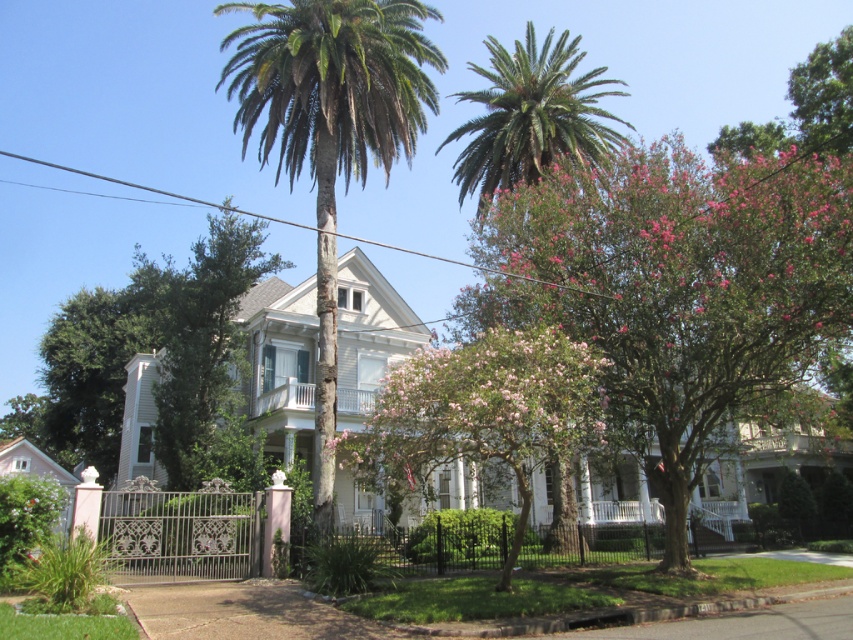
You are a gardener planning to trim both the pink leafy tree at upper right and the pink bloom tree at center. Based on their positions, which tree should you tackle first if you want to start from the lowest point in the image?

You should start with the pink bloom tree at center because it is positioned lower than the pink leafy tree at upper right, which is above it.

You are standing at the entrance of the house and want to take a photo that includes both the point at coordinates point [395,19] and point [576,433]. Which point should be closer to the camera in your photo?

Point [395,19] is further to the camera than point [576,433], so in the photo, point [576,433] will appear closer to the camera.

You are a gardener standing at the wrought iron gate at the entrance of the house. You need to water both the pink bloom tree at center and the green leafy palm tree at upper center. Which tree should you water first if you want to start with the one nearest to you?

The pink bloom tree at center is closer to the viewer than the green leafy palm tree at upper center, so you should water the pink bloom tree at center first.